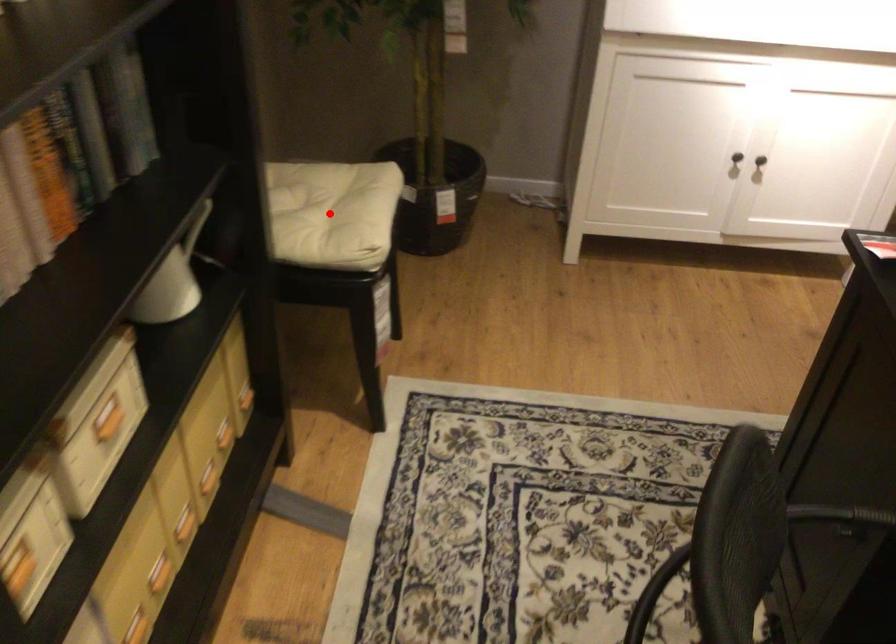
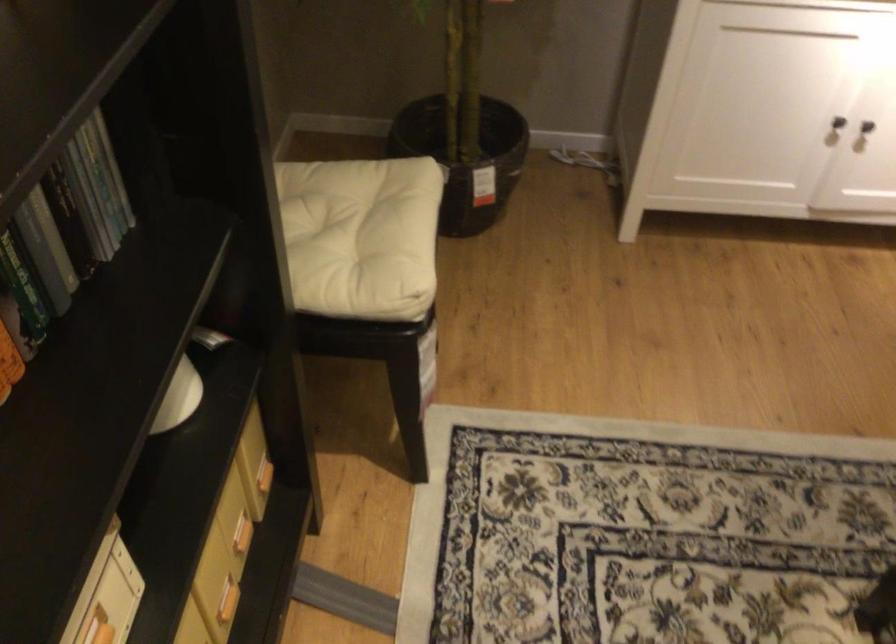
The point at the highlighted location is marked in the first image. Where is the corresponding point in the second image?

(355, 234)